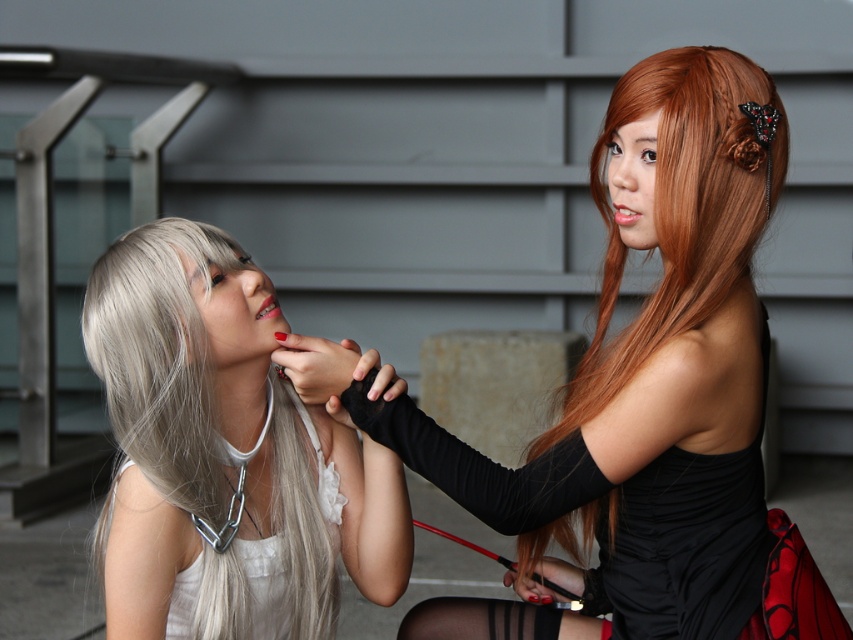
Question: Is shiny orange hair at right positioned at the back of matte red lipstick at center?

Choices:
 (A) yes
 (B) no

Answer: (B)

Question: Can you confirm if shiny black dress at center is thinner than sheer black tights at lower center?

Choices:
 (A) no
 (B) yes

Answer: (A)

Question: Which point is farther from the camera taking this photo?

Choices:
 (A) (692, 145)
 (B) (276, 310)
 (C) (643, 404)
 (D) (498, 627)

Answer: (D)

Question: Does shiny orange hair at right lie behind matte red lipstick at upper right?

Choices:
 (A) no
 (B) yes

Answer: (A)

Question: Based on their relative distances, which object is nearer to the shiny orange hair at right?

Choices:
 (A) shiny black dress at center
 (B) sheer black tights at lower center

Answer: (A)

Question: Which of the following is the closest to the observer?

Choices:
 (A) (636, 198)
 (B) (639, 113)
 (C) (245, 634)
 (D) (473, 611)

Answer: (B)